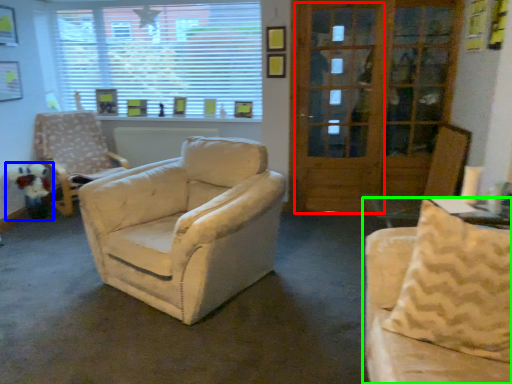
Question: Which is farther away from screen door (highlighted by a red box)? toy (highlighted by a blue box) or studio couch (highlighted by a green box)?

Choices:
 (A) toy
 (B) studio couch

Answer: (A)